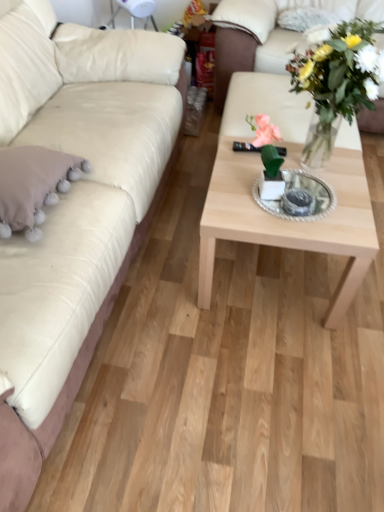
Question: From a real-world perspective, is fluffy white pillow at upper right, the second pillow viewed from the left, physically located above or below matte white couch at left, the 2th studio couch when ordered from right to left?

Choices:
 (A) above
 (B) below

Answer: (A)

Question: Does point (294, 10) appear closer or farther from the camera than point (124, 55)?

Choices:
 (A) closer
 (B) farther

Answer: (B)

Question: Which object is positioned farthest from the fluffy white pillow at upper right, the 2th pillow when ordered from bottom to top?

Choices:
 (A) matte white couch at left, which ranks as the first studio couch in left-to-right order
 (B) natural wood coffee table at center
 (C) white leather studio couch at upper right, the first studio couch in the right-to-left sequence
 (D) beige fabric pillow at left, which is the 2th pillow from right to left

Answer: (D)

Question: Which is farther from the fluffy white pillow at upper right, marked as the first pillow in a right-to-left arrangement?

Choices:
 (A) beige fabric pillow at left, the first pillow when ordered from bottom to top
 (B) matte white couch at left, the 2th studio couch when ordered from right to left
 (C) natural wood coffee table at center
 (D) white leather studio couch at upper right, the first studio couch in the right-to-left sequence

Answer: (A)